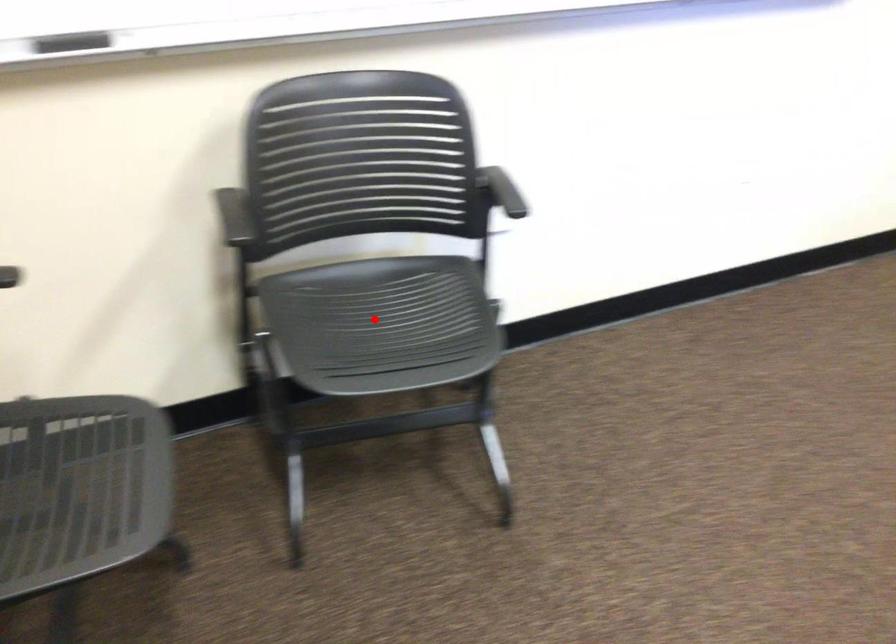
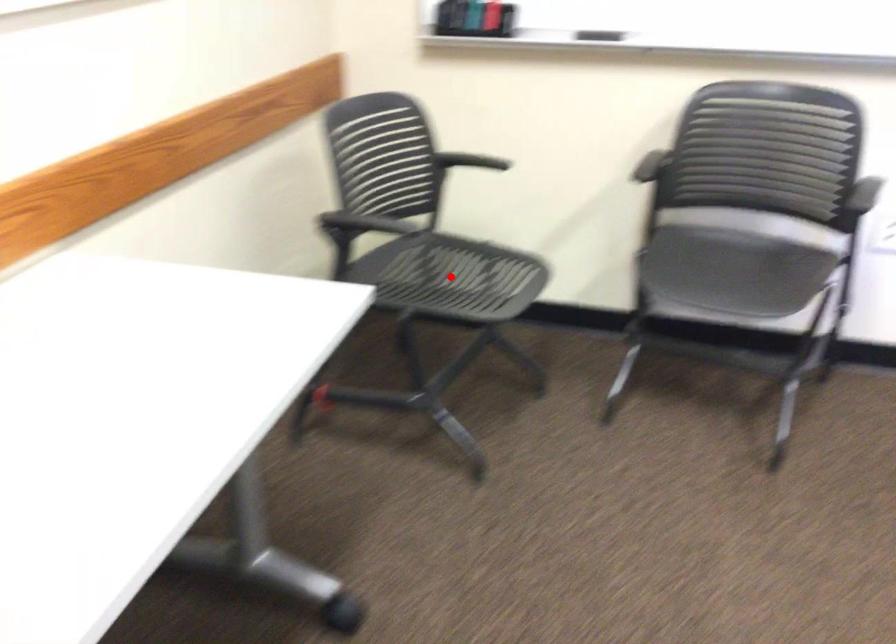
I am providing you with two images of the same scene from different viewpoints. A red point is marked on the first image and another point is marked on the second image. Is the red point in image1 aligned with the point shown in image2?

No